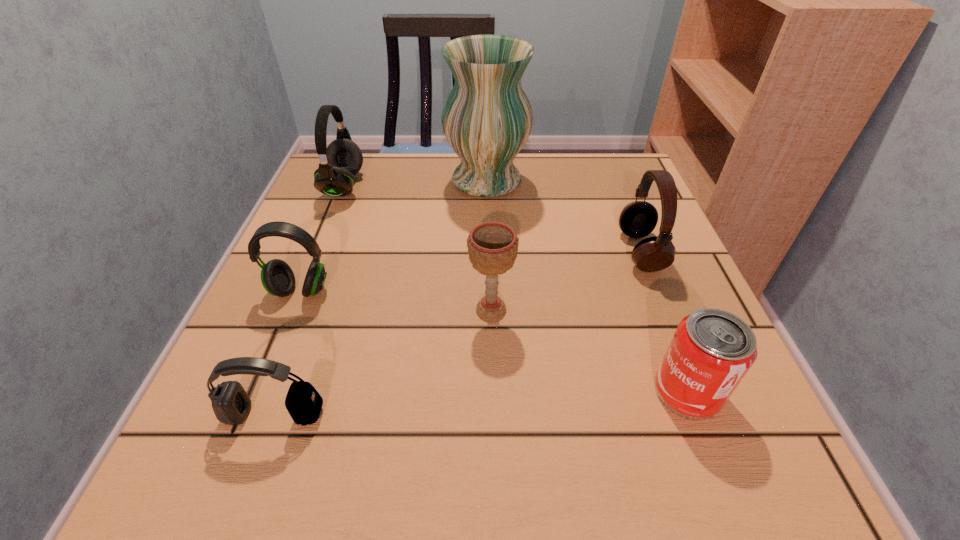
Where is `unoccupied area between the shortest headset and the chalice`? The image size is (960, 540). unoccupied area between the shortest headset and the chalice is located at coordinates (383, 362).

Identify the location of empty space that is in between the chalice and the farthest headset. This screenshot has width=960, height=540. (418, 248).

At what (x,y) coordinates should I click in order to perform the action: click on object that ranks as the second closest to the shortest headset. Please return your answer as a coordinate pair (x, y). Image resolution: width=960 pixels, height=540 pixels. Looking at the image, I should click on (492, 246).

In order to click on object that is the fourth closest to the farthest headset in this screenshot , I will do `click(231, 404)`.

Where is `headset that is the second nearest to the chalice`? headset that is the second nearest to the chalice is located at coordinates (231, 404).

Identify which headset is located as the fourth nearest to the can. Please provide its 2D coordinates. Your answer should be formatted as a tuple, i.e. [(x, y)], where the tuple contains the x and y coordinates of a point satisfying the conditions above.

[(339, 162)]

You are a GUI agent. You are given a task and a screenshot of the screen. Output one action in this format:
    pyautogui.click(x=<x>, y=<y>)
    Task: Click on the free space that satisfies the following two spatial constraints: 1. on the ear pads of the rightmost headset; 2. on the headband of the shortest headset
    
    Given the screenshot: What is the action you would take?
    pyautogui.click(x=706, y=414)

Find the location of a particular element. The width and height of the screenshot is (960, 540). free spot that satisfies the following two spatial constraints: 1. on the front side of the chalice; 2. on the left side of the can is located at coordinates (493, 392).

Find the location of `free point that satisfies the following two spatial constraints: 1. on the front side of the can; 2. on the left side of the tallest object`. free point that satisfies the following two spatial constraints: 1. on the front side of the can; 2. on the left side of the tallest object is located at coordinates (491, 392).